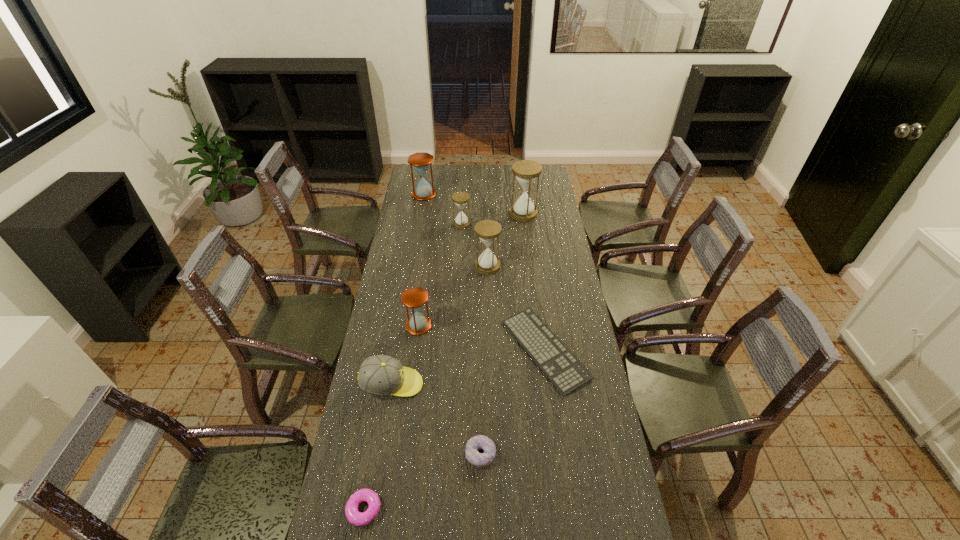
In order to click on vacant space located 0.240m on the right of the third hourglass from right to left in this screenshot , I will do `click(517, 224)`.

Locate an element on the screen. free region located on the front of the nearest hourglass is located at coordinates (408, 405).

Locate an element on the screen. The width and height of the screenshot is (960, 540). free space located 0.160m on the front-facing side of the yellow baseball cap is located at coordinates (468, 384).

Find the location of a particular element. Image resolution: width=960 pixels, height=540 pixels. vacant region located on the right of the farther doughnut is located at coordinates (564, 454).

Where is `free space located on the back of the left doughnut`? free space located on the back of the left doughnut is located at coordinates (382, 407).

Where is `vacant area located 0.200m on the back of the computer keyboard`? This screenshot has width=960, height=540. vacant area located 0.200m on the back of the computer keyboard is located at coordinates [x=535, y=277].

This screenshot has width=960, height=540. Find the location of `baseball cap that is at the left edge`. baseball cap that is at the left edge is located at coordinates (383, 375).

Identify the location of doughnut that is at the left edge. (355, 517).

Locate an element on the screen. The height and width of the screenshot is (540, 960). hourglass at the right edge is located at coordinates (526, 171).

This screenshot has height=540, width=960. Identify the location of computer keyboard at the right edge. (562, 368).